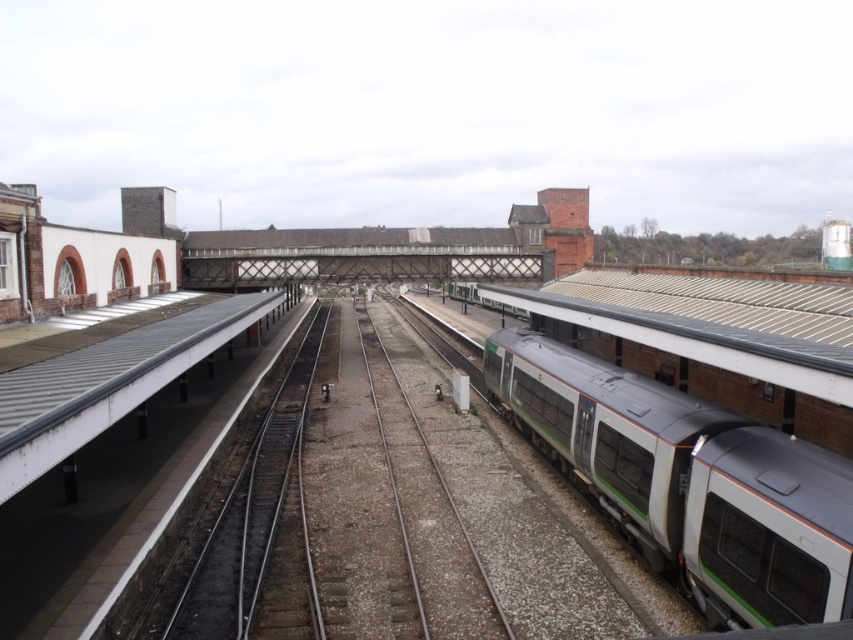
Question: Which of the following is the farthest from the observer?

Choices:
 (A) green metallic train at right
 (B) smooth concrete platform at center

Answer: (A)

Question: Is smooth concrete platform at center to the right of green metallic train at right from the viewer's perspective?

Choices:
 (A) no
 (B) yes

Answer: (A)

Question: Which point is farther to the camera?

Choices:
 (A) smooth concrete platform at center
 (B) green metallic train at right

Answer: (B)

Question: Does smooth concrete platform at center appear under green metallic train at right?

Choices:
 (A) no
 (B) yes

Answer: (A)

Question: Does smooth concrete platform at center appear under green metallic train at right?

Choices:
 (A) no
 (B) yes

Answer: (A)